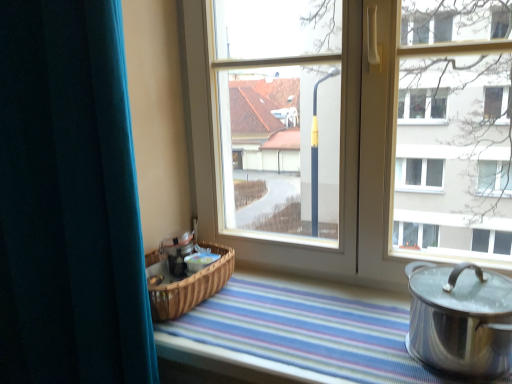
Question: Considering the positions of polished silver pot at lower right and transparent glass window at center in the image, is polished silver pot at lower right wider or thinner than transparent glass window at center?

Choices:
 (A) thin
 (B) wide

Answer: (B)

Question: Considering the positions of polished silver pot at lower right and transparent glass window at center in the image, is polished silver pot at lower right taller or shorter than transparent glass window at center?

Choices:
 (A) short
 (B) tall

Answer: (A)

Question: Which is farther from the teal velvet curtain at left?

Choices:
 (A) polished silver pot at lower right
 (B) transparent glass window at center

Answer: (A)

Question: Estimate the real-world distances between objects in this image. Which object is closer to the polished silver pot at lower right?

Choices:
 (A) transparent glass window at center
 (B) teal velvet curtain at left

Answer: (A)